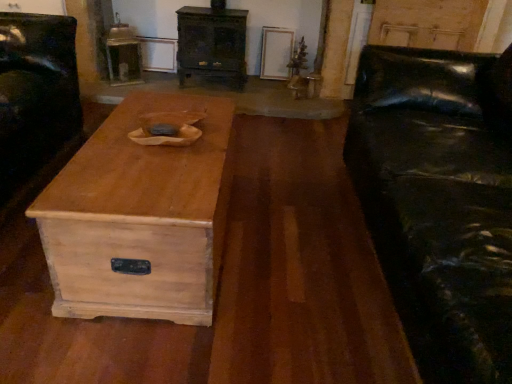
Question: Is black leather couch at right wider or thinner than black leather armchair at left?

Choices:
 (A) wide
 (B) thin

Answer: (A)

Question: From the image's perspective, is black leather couch at right located above or below black leather armchair at left?

Choices:
 (A) below
 (B) above

Answer: (A)

Question: Which object is positioned farthest from the black leather couch at right?

Choices:
 (A) black leather armchair at left
 (B) light brown wood coffee table at center
 (C) wooden chest of drawers at center

Answer: (C)

Question: Based on their relative distances, which object is farther from the black leather armchair at left?

Choices:
 (A) black leather couch at right
 (B) wooden chest of drawers at center
 (C) light brown wood coffee table at center

Answer: (A)